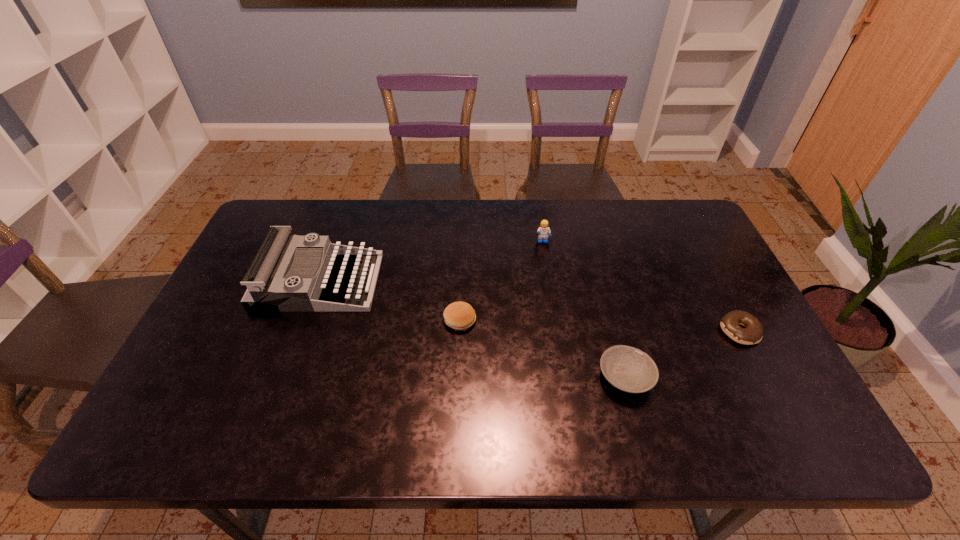
You are a GUI agent. You are given a task and a screenshot of the screen. Output one action in this format:
    pyautogui.click(x=<x>, y=<y>)
    Task: Click on the empty space between the doughnut and the tallest object
    This screenshot has height=540, width=960.
    Given the screenshot: What is the action you would take?
    pyautogui.click(x=529, y=306)

The height and width of the screenshot is (540, 960). What are the coordinates of `object that can be found as the fourth closest to the patty` in the screenshot? It's located at (752, 334).

Identify the location of the fourth closest object to the doughnut. The height and width of the screenshot is (540, 960). (270, 287).

You are a GUI agent. You are given a task and a screenshot of the screen. Output one action in this format:
    pyautogui.click(x=<x>, y=<y>)
    Task: Click on the vacant space that satisfies the following two spatial constraints: 1. on the back side of the rightmost object; 2. on the left side of the fourth object from left to right
    The height and width of the screenshot is (540, 960).
    Given the screenshot: What is the action you would take?
    pyautogui.click(x=613, y=331)

Image resolution: width=960 pixels, height=540 pixels. In order to click on blank space that satisfies the following two spatial constraints: 1. on the typing side of the typewriter; 2. on the back side of the second object from left to right in this screenshot , I will do `click(305, 320)`.

Identify the location of free location that satisfies the following two spatial constraints: 1. on the back side of the doughnut; 2. on the left side of the fourth object from left to right. The width and height of the screenshot is (960, 540). (613, 331).

Where is `free location that satisfies the following two spatial constraints: 1. on the typing side of the bowl; 2. on the right side of the leftmost object`? Image resolution: width=960 pixels, height=540 pixels. free location that satisfies the following two spatial constraints: 1. on the typing side of the bowl; 2. on the right side of the leftmost object is located at coordinates (284, 377).

This screenshot has height=540, width=960. Identify the location of free space that satisfies the following two spatial constraints: 1. on the typing side of the doughnut; 2. on the left side of the leftmost object. (300, 331).

Identify the location of vacant position in the image that satisfies the following two spatial constraints: 1. on the front-facing side of the farthest object; 2. on the right side of the doughnut. (557, 331).

At what (x,y) coordinates should I click in order to perform the action: click on vacant space that satisfies the following two spatial constraints: 1. on the front-facing side of the nearest object; 2. on the right side of the Lego. Please return your answer as a coordinate pair (x, y). This screenshot has height=540, width=960. Looking at the image, I should click on (564, 377).